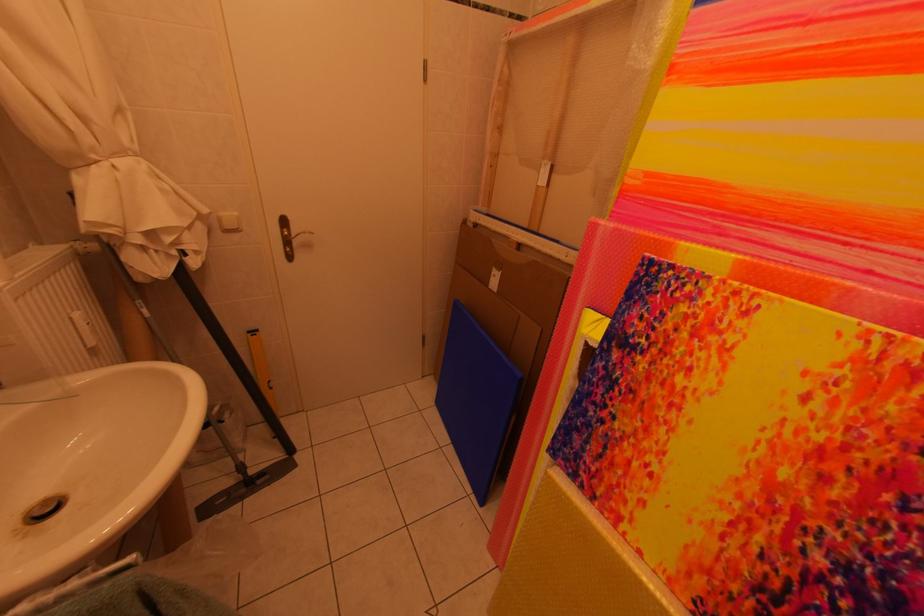
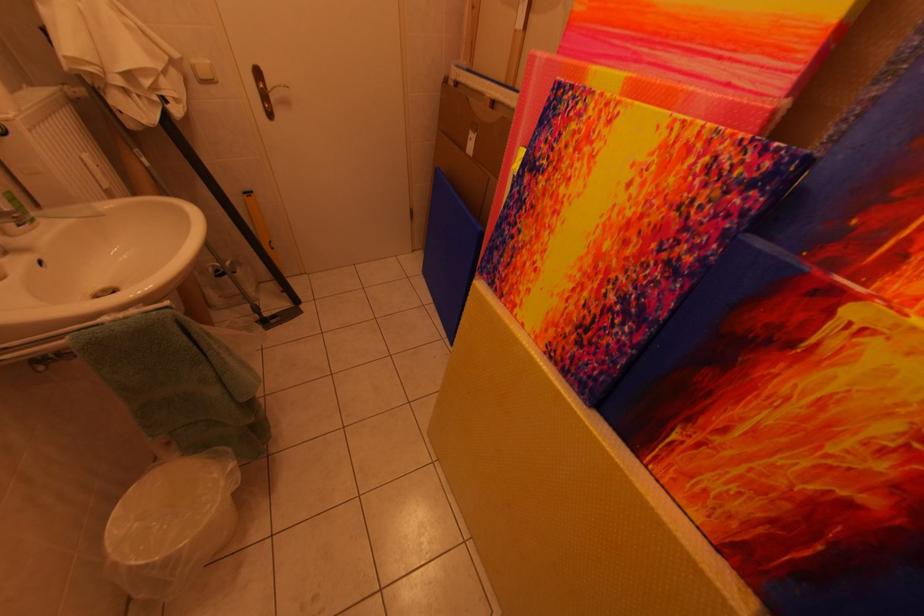
In the second image, find the point that corresponds to [292,237] in the first image.

(268, 91)